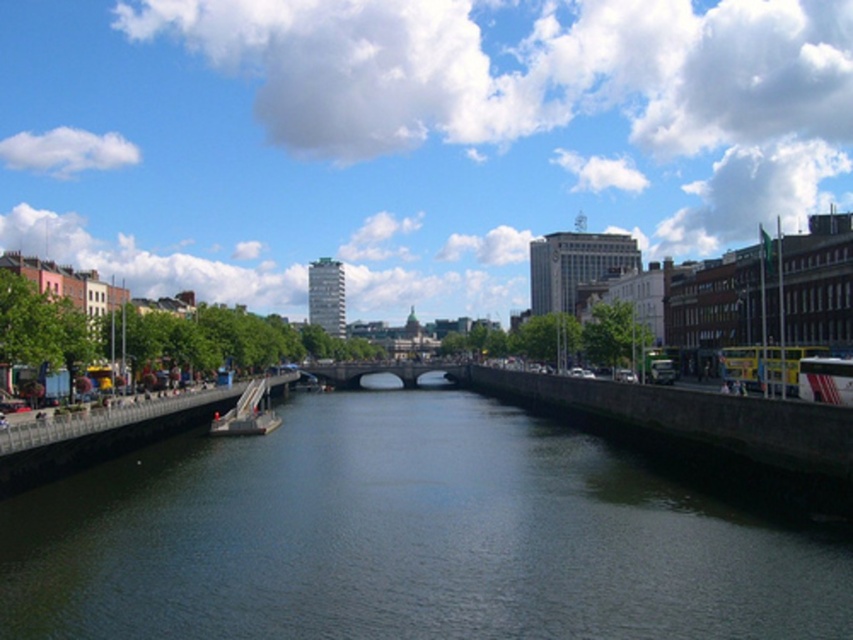
Question: Which point is farther to the camera?

Choices:
 (A) (235, 403)
 (B) (357, 371)
 (C) (196, 561)

Answer: (B)

Question: Based on their relative distances, which object is farther from the metallic gray boat at center?

Choices:
 (A) blue sky at upper center
 (B) dark gray stone bridge at center

Answer: (A)

Question: Does dark blue water at center lie behind metallic gray boat at center?

Choices:
 (A) no
 (B) yes

Answer: (A)

Question: From the image, what is the correct spatial relationship of blue sky at upper center in relation to metallic gray boat at center?

Choices:
 (A) below
 (B) above

Answer: (B)

Question: Among these objects, which one is farthest from the camera?

Choices:
 (A) metallic gray boat at center
 (B) dark gray stone bridge at center
 (C) dark blue water at center
 (D) blue sky at upper center

Answer: (D)

Question: Does blue sky at upper center have a lesser width compared to dark blue water at center?

Choices:
 (A) yes
 (B) no

Answer: (B)